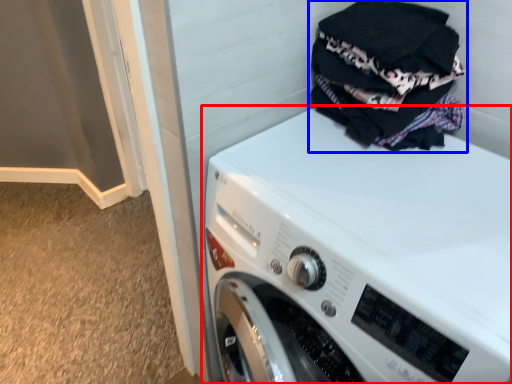
Question: Which point is closer to the camera, washing machine (highlighted by a red box) or laundry (highlighted by a blue box)?

Choices:
 (A) washing machine
 (B) laundry

Answer: (A)